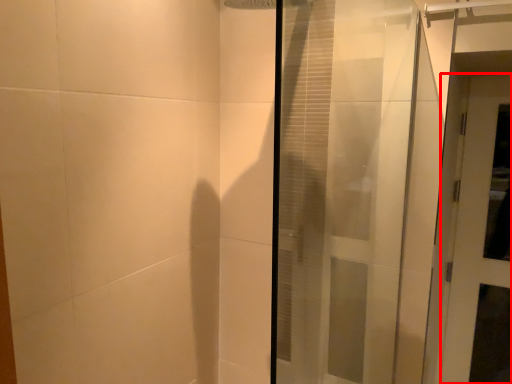
Question: From the image's perspective, what is the correct spatial positioning of door (annotated by the red box) in reference to door?

Choices:
 (A) above
 (B) below

Answer: (B)